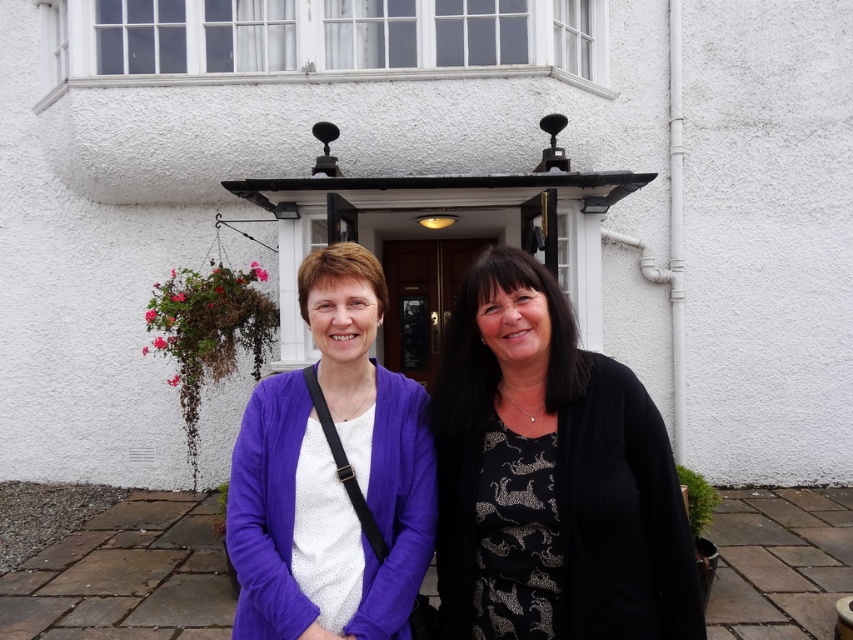
Is black textured dress at center below purple fabric sweater at center?

Yes.

Where is `black textured dress at center`? The height and width of the screenshot is (640, 853). black textured dress at center is located at coordinates (550, 476).

This screenshot has height=640, width=853. What do you see at coordinates (550, 476) in the screenshot?
I see `black textured dress at center` at bounding box center [550, 476].

Find the location of a particular element. This screenshot has width=853, height=640. black textured dress at center is located at coordinates (550, 476).